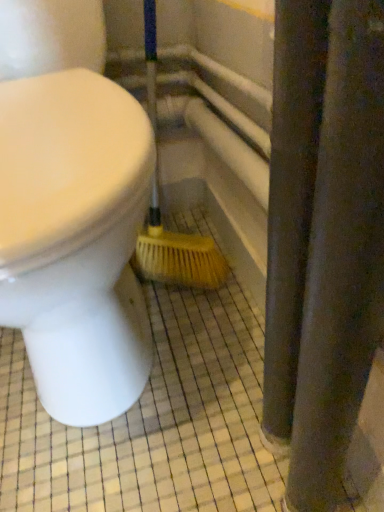
Find the location of a particular element. white matte bidet at lower left is located at coordinates (75, 239).

This screenshot has width=384, height=512. What do you see at coordinates (75, 239) in the screenshot?
I see `white matte bidet at lower left` at bounding box center [75, 239].

Find the location of a particular element. The image size is (384, 512). white matte bidet at lower left is located at coordinates (75, 239).